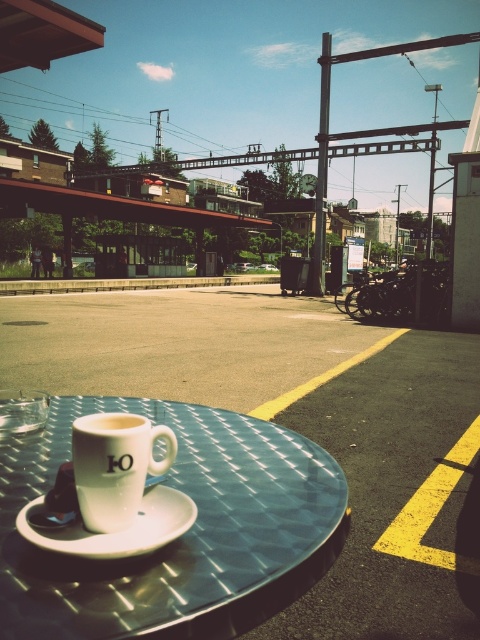
Is metallic textured table at center thinner than white ceramic saucer at center?

In fact, metallic textured table at center might be wider than white ceramic saucer at center.

What do you see at coordinates (180, 538) in the screenshot? I see `metallic textured table at center` at bounding box center [180, 538].

Is point (38, 573) less distant than point (66, 538)?

Yes.

This screenshot has width=480, height=640. I want to click on metallic textured table at center, so click(180, 538).

This screenshot has height=640, width=480. In order to click on white matte mug at center in this screenshot , I will do `click(116, 467)`.

Between point (88, 468) and point (52, 541), which one is positioned in front?

Positioned in front is point (52, 541).

Does point (100, 481) come closer to viewer compared to point (83, 540)?

No.

Identify the location of white matte mug at center. (116, 467).

Is metallic textured table at center taller than white matte mug at center?

In fact, metallic textured table at center may be shorter than white matte mug at center.

Does metallic textured table at center have a lesser width compared to white matte mug at center?

In fact, metallic textured table at center might be wider than white matte mug at center.

Is point (21, 568) behind point (108, 451)?

No, (21, 568) is in front of (108, 451).

Where is `metallic textured table at center`? The width and height of the screenshot is (480, 640). metallic textured table at center is located at coordinates (180, 538).